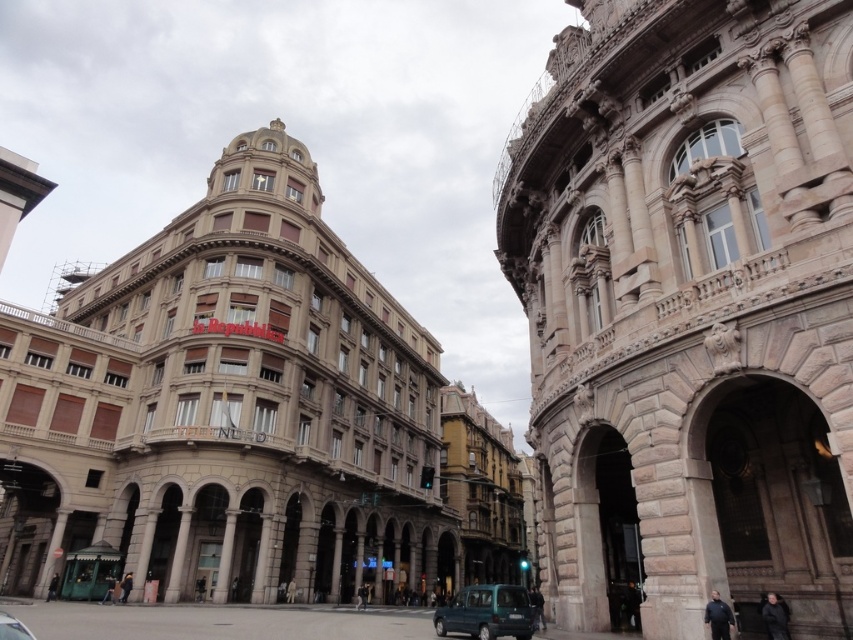
Question: Does teal matte car at lower center have a lesser width compared to metallic silver car at lower left?

Choices:
 (A) no
 (B) yes

Answer: (B)

Question: Among these objects, which one is nearest to the camera?

Choices:
 (A) teal matte car at lower center
 (B) metallic silver car at lower left

Answer: (B)

Question: Does teal matte car at lower center appear over metallic silver car at lower left?

Choices:
 (A) yes
 (B) no

Answer: (B)

Question: Which of the following is the closest to the observer?

Choices:
 (A) (25, 627)
 (B) (508, 620)

Answer: (A)

Question: Can you confirm if teal matte car at lower center is bigger than metallic silver car at lower left?

Choices:
 (A) no
 (B) yes

Answer: (B)

Question: Which object appears closest to the camera in this image?

Choices:
 (A) teal matte car at lower center
 (B) metallic silver car at lower left

Answer: (B)